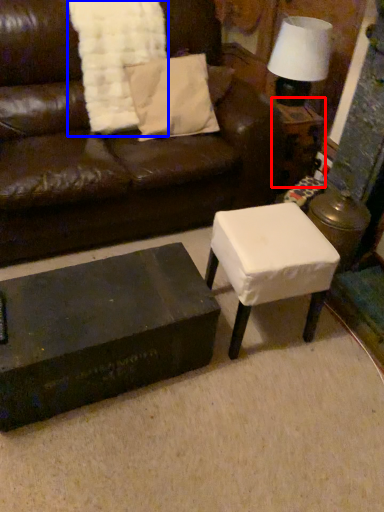
Question: Which object is further to the camera taking this photo, side table (highlighted by a red box) or blanket (highlighted by a blue box)?

Choices:
 (A) side table
 (B) blanket

Answer: (A)